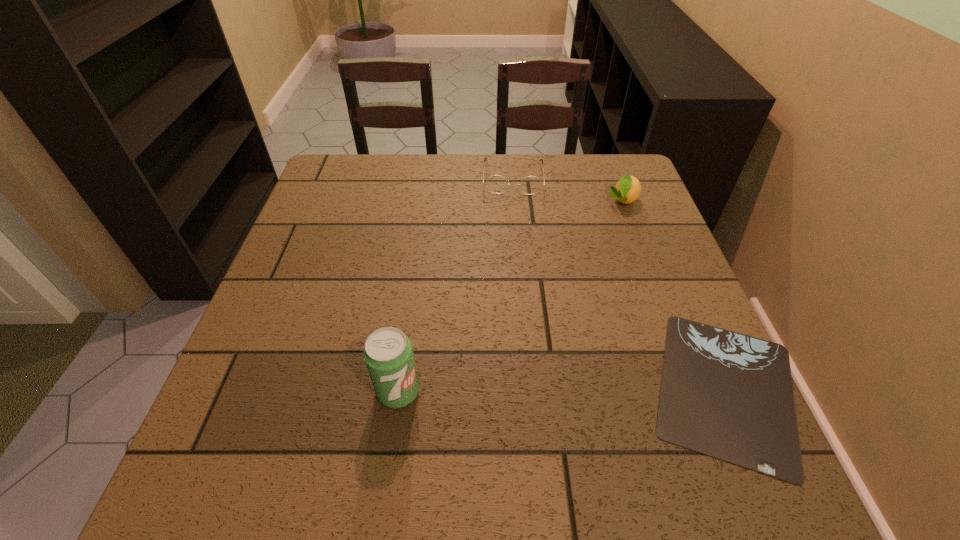
Locate an element on the screen. The image size is (960, 540). the tallest object is located at coordinates (388, 354).

Locate an element on the screen. soda is located at coordinates (388, 354).

Locate an element on the screen. The height and width of the screenshot is (540, 960). the shortest object is located at coordinates (727, 395).

I want to click on the third shortest object, so click(627, 190).

In order to click on spectacles in this screenshot , I will do `click(497, 184)`.

At what (x,y) coordinates should I click in order to perform the action: click on the second shortest object. Please return your answer as a coordinate pair (x, y). This screenshot has width=960, height=540. Looking at the image, I should click on (497, 184).

Find the location of `vacant space located on the right of the leftmost object`. vacant space located on the right of the leftmost object is located at coordinates (582, 392).

Where is `vacant space positioned 0.400m on the left of the shortest object`? This screenshot has height=540, width=960. vacant space positioned 0.400m on the left of the shortest object is located at coordinates (421, 389).

You are a GUI agent. You are given a task and a screenshot of the screen. Output one action in this format:
    pyautogui.click(x=<x>, y=<y>)
    Task: Click on the vacant area located 0.190m with leaves positioned above the second tallest object
    The height and width of the screenshot is (540, 960).
    Given the screenshot: What is the action you would take?
    tap(603, 258)

Locate an element on the screen. This screenshot has width=960, height=540. blank space located with leaves positioned above the second tallest object is located at coordinates (603, 258).